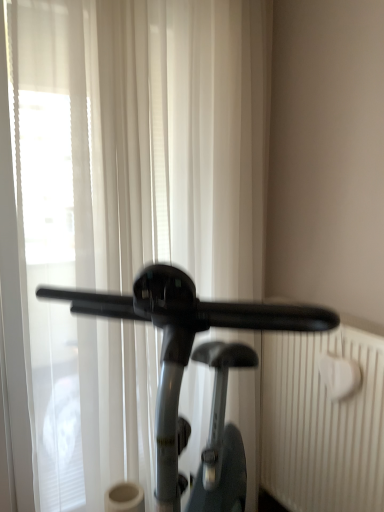
Question: Is white sheer curtain at center outside white textured radiator at right?

Choices:
 (A) yes
 (B) no

Answer: (A)

Question: From the image's perspective, is white sheer curtain at center over white textured radiator at right?

Choices:
 (A) no
 (B) yes

Answer: (B)

Question: Is white sheer curtain at center wider than white textured radiator at right?

Choices:
 (A) no
 (B) yes

Answer: (B)

Question: Can you confirm if white sheer curtain at center is thinner than white textured radiator at right?

Choices:
 (A) no
 (B) yes

Answer: (A)

Question: From the image's perspective, would you say white sheer curtain at center is shown under white textured radiator at right?

Choices:
 (A) no
 (B) yes

Answer: (A)

Question: Relative to black glossy stationary bicycle at center, is white textured radiator at right in front or behind?

Choices:
 (A) behind
 (B) front

Answer: (A)

Question: From the image's perspective, is white textured radiator at right above or below black glossy stationary bicycle at center?

Choices:
 (A) above
 (B) below

Answer: (B)

Question: In terms of size, does white textured radiator at right appear bigger or smaller than black glossy stationary bicycle at center?

Choices:
 (A) small
 (B) big

Answer: (A)

Question: Is white textured radiator at right wider or thinner than black glossy stationary bicycle at center?

Choices:
 (A) wide
 (B) thin

Answer: (B)

Question: From a real-world perspective, is white sheer curtain at center physically located above or below white textured radiator at right?

Choices:
 (A) above
 (B) below

Answer: (A)

Question: From the image's perspective, is white sheer curtain at center positioned above or below white textured radiator at right?

Choices:
 (A) above
 (B) below

Answer: (A)

Question: Considering the positions of point (160, 212) and point (377, 434), is point (160, 212) closer or farther from the camera than point (377, 434)?

Choices:
 (A) farther
 (B) closer

Answer: (A)

Question: Is white sheer curtain at center in front of or behind white textured radiator at right in the image?

Choices:
 (A) front
 (B) behind

Answer: (A)

Question: From a real-world perspective, is white textured radiator at right physically located above or below white sheer curtain at center?

Choices:
 (A) below
 (B) above

Answer: (A)

Question: Considering the positions of white textured radiator at right and white sheer curtain at center in the image, is white textured radiator at right bigger or smaller than white sheer curtain at center?

Choices:
 (A) big
 (B) small

Answer: (B)